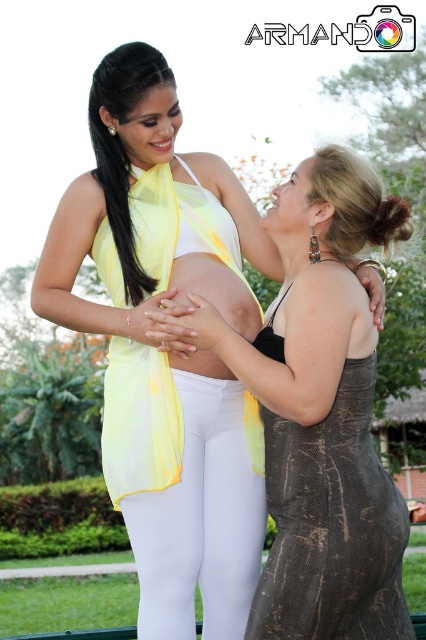
Question: Estimate the real-world distances between objects in this image. Which object is closer to the white matte leggings at center?

Choices:
 (A) matte yellow skin at center
 (B) brown textured dress at center

Answer: (B)

Question: Does brown textured dress at center appear over white matte leggings at center?

Choices:
 (A) yes
 (B) no

Answer: (A)

Question: In this image, where is brown textured dress at center located relative to white matte leggings at center?

Choices:
 (A) right
 (B) left

Answer: (A)

Question: From the image, what is the correct spatial relationship of brown textured dress at center in relation to matte yellow skin at center?

Choices:
 (A) below
 (B) above

Answer: (A)

Question: Considering the real-world distances, which object is closest to the matte yellow skin at center?

Choices:
 (A) brown textured dress at center
 (B) white matte leggings at center

Answer: (B)

Question: Estimate the real-world distances between objects in this image. Which object is farther from the matte yellow skin at center?

Choices:
 (A) brown textured dress at center
 (B) white matte leggings at center

Answer: (A)